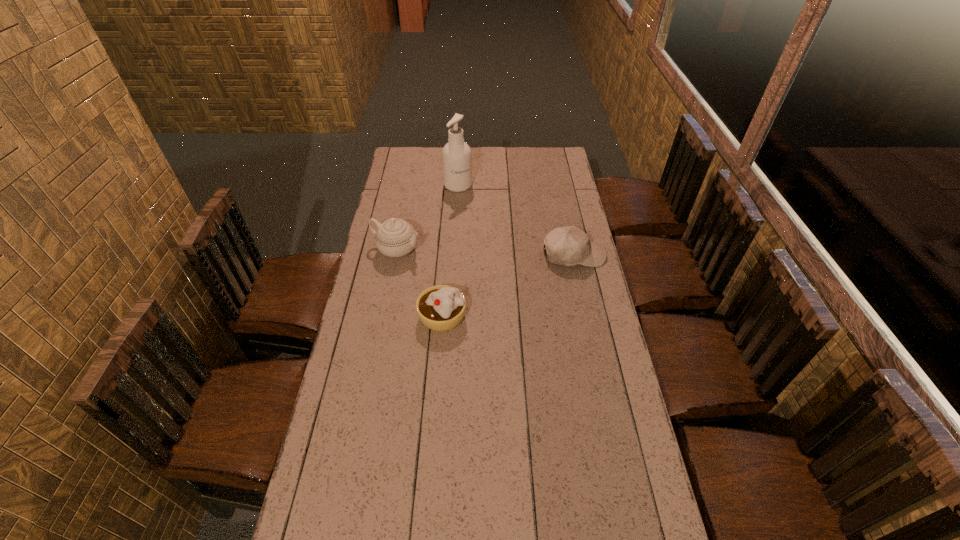
Locate an element on the screen. Image resolution: width=960 pixels, height=540 pixels. free spot on the desktop that is between the nearest object and the rightmost object and is positioned on the front label of the tallest object is located at coordinates (510, 285).

You are a GUI agent. You are given a task and a screenshot of the screen. Output one action in this format:
    pyautogui.click(x=<x>, y=<y>)
    Task: Click on the vacant space on the desktop that is between the nearest object and the rightmost object and is positioned on the spout of the leftmost object
    
    Given the screenshot: What is the action you would take?
    pyautogui.click(x=505, y=287)